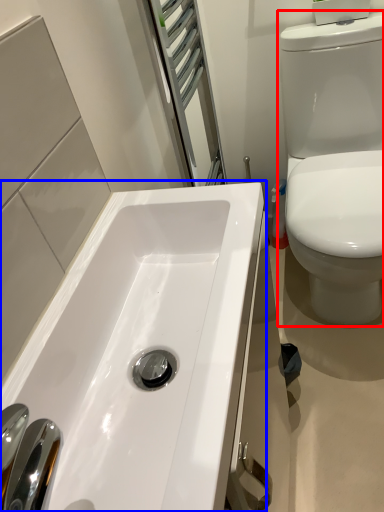
Question: Which object is closer to the camera taking this photo, toilet (highlighted by a red box) or sink (highlighted by a blue box)?

Choices:
 (A) toilet
 (B) sink

Answer: (B)